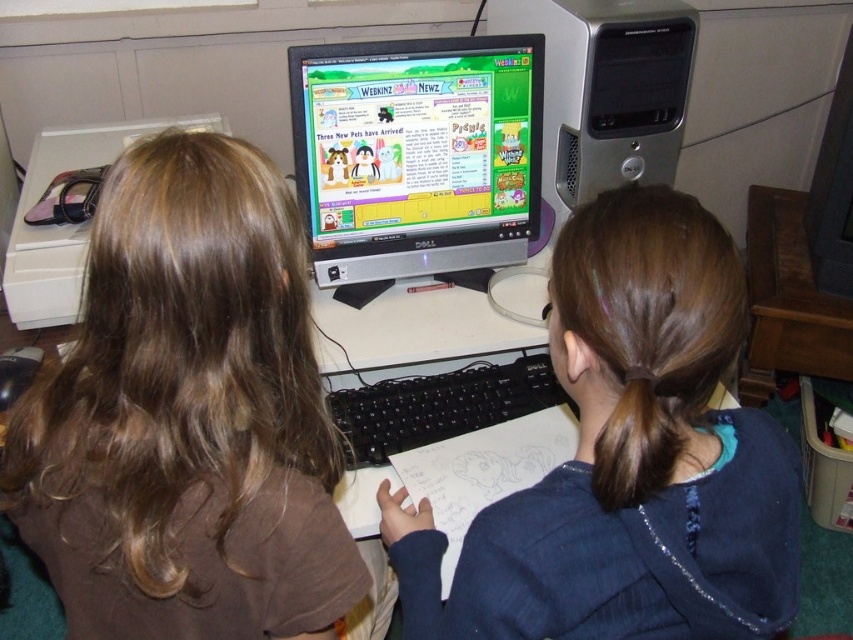
Question: Can you confirm if brown matte hair at upper left is positioned below dark blue sweater at center?

Choices:
 (A) yes
 (B) no

Answer: (B)

Question: Among these points, which one is nearest to the camera?

Choices:
 (A) (334, 484)
 (B) (300, 67)
 (C) (456, 570)

Answer: (C)

Question: Which is farther from the brown matte hair at upper left?

Choices:
 (A) dark blue sweater at center
 (B) matte silver monitor at center

Answer: (B)

Question: Among these objects, which one is farthest from the camera?

Choices:
 (A) brown matte hair at upper left
 (B) matte silver monitor at center

Answer: (B)

Question: Does brown matte hair at upper left have a smaller size compared to dark blue sweater at center?

Choices:
 (A) yes
 (B) no

Answer: (A)

Question: Does dark blue sweater at center appear under matte silver monitor at center?

Choices:
 (A) yes
 (B) no

Answer: (A)